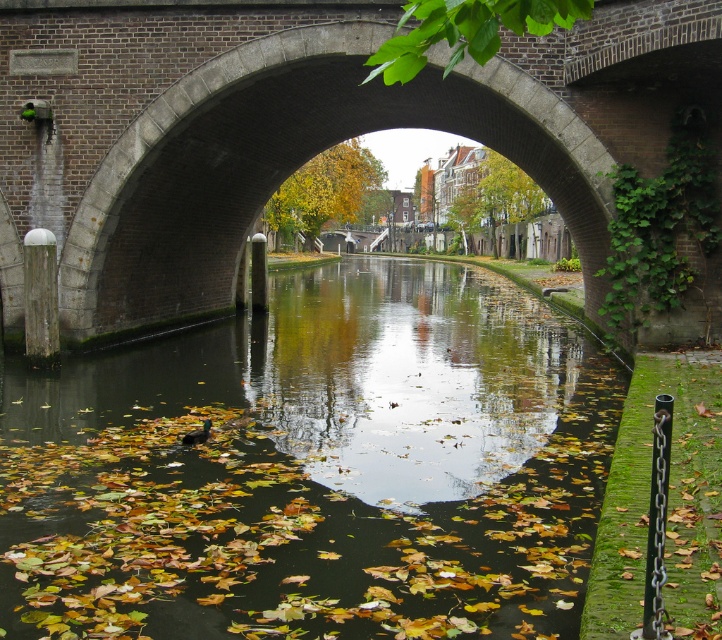
Based on the photo, you are a boat captain trying to navigate through the canal in the image. The boat you are operating is 10 meters wide. Given the green mossy canal at center and the brick stone bridge at center, can your boat pass under the bridge without getting stuck?

The green mossy canal at center is wider than the brick stone bridge at center. Since the boat is 10 meters wide, it can pass under the bridge as long as the canal width accommodates the boat. However, the bridge itself might have a lower height, but the question is about width. The canal is wider than the bridge, so the boat can pass through the canal under the bridge if the bridge opening is sufficient. However, the provided information only mentions width comparison between the canal and bridge, not the

Looking at this image, you are standing at the center of the arched bridge in the canal scene. You want to know the exact location of the green mossy canal at center. What are its coordinates?

The green mossy canal at center is located at coordinates point (x=316, y=468).

From the picture: You are standing on the arched bridge in the canal scene. You see a point marked at coordinates (x=316, y=468). Based on the scene description, where is this point located?

The point is located on the green mossy canal at center.